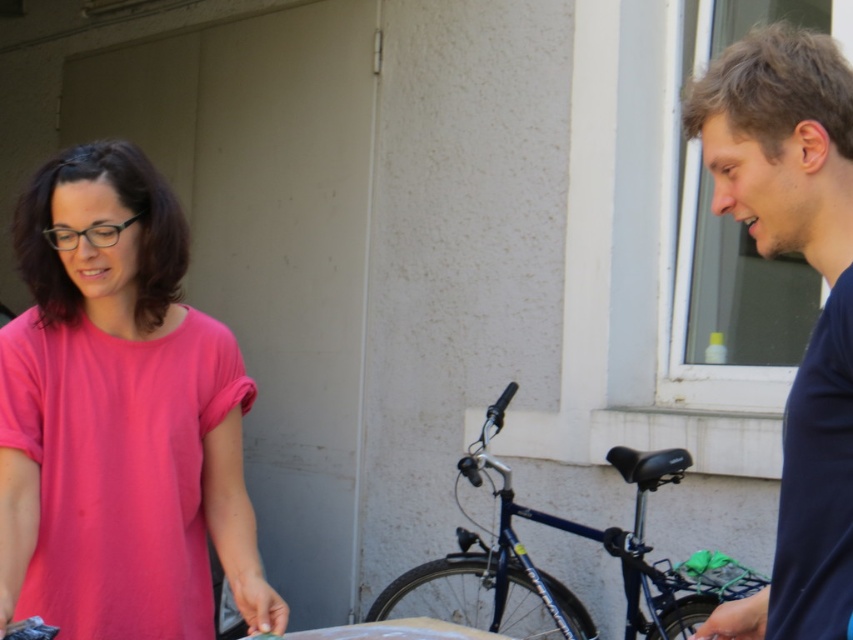
Question: Which object is closer to the camera taking this photo?

Choices:
 (A) dark blue shirt at right
 (B) pink matte shirt at left

Answer: (A)

Question: Can you confirm if pink matte shirt at left is thinner than shiny blue bicycle at center?

Choices:
 (A) yes
 (B) no

Answer: (A)

Question: Observing the image, what is the correct spatial positioning of pink matte shirt at left in reference to dark blue shirt at right?

Choices:
 (A) left
 (B) right

Answer: (A)

Question: Among these points, which one is nearest to the camera?

Choices:
 (A) (119, 552)
 (B) (776, 580)

Answer: (B)

Question: Does pink matte shirt at left have a larger size compared to shiny blue bicycle at center?

Choices:
 (A) no
 (B) yes

Answer: (A)

Question: Which of these objects is positioned closest to the shiny blue bicycle at center?

Choices:
 (A) dark blue shirt at right
 (B) pink matte shirt at left

Answer: (B)